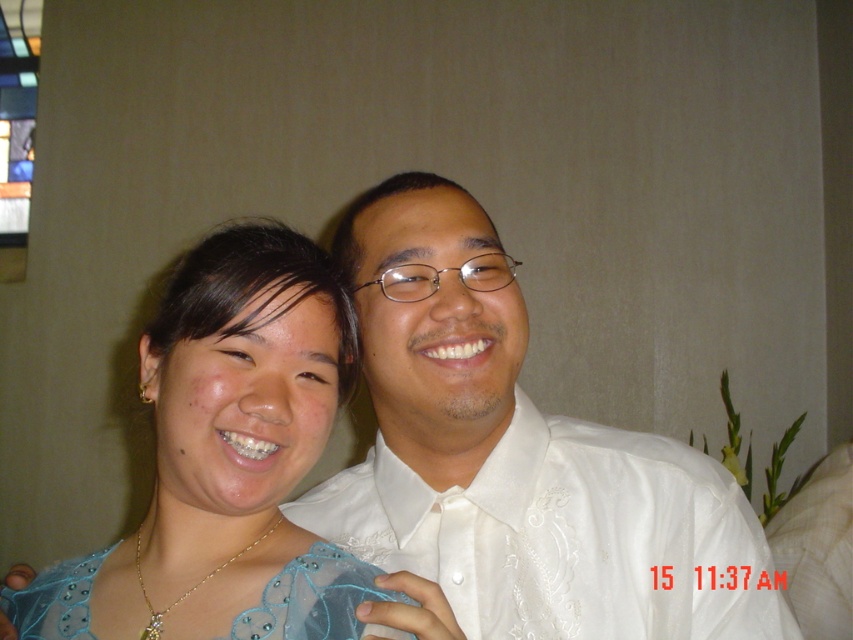
Question: Which point is farther from the camera taking this photo?

Choices:
 (A) (366, 593)
 (B) (730, 547)
 (C) (289, 355)

Answer: (B)

Question: Does white satin shirt at center have a lesser width compared to satin blue dress at lower left?

Choices:
 (A) no
 (B) yes

Answer: (A)

Question: Considering the relative positions of white satin shirt at center and satin blue dress at lower left in the image provided, where is white satin shirt at center located with respect to satin blue dress at lower left?

Choices:
 (A) left
 (B) right

Answer: (B)

Question: Which point is farther to the camera?

Choices:
 (A) (106, 570)
 (B) (329, 531)
 (C) (316, 616)

Answer: (B)

Question: Which is farther from the blue satin dress at lower left?

Choices:
 (A) satin blue dress at lower left
 (B) white satin shirt at center

Answer: (B)

Question: Is blue satin dress at lower left thinner than satin blue dress at lower left?

Choices:
 (A) yes
 (B) no

Answer: (A)